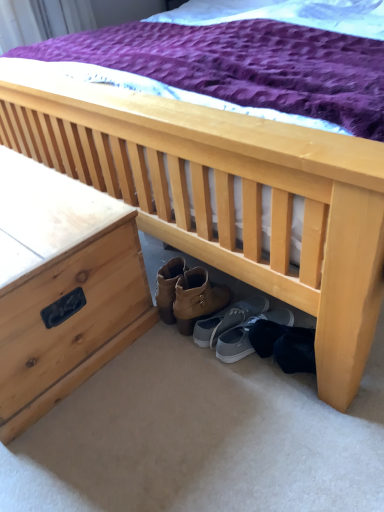
Question: Considering the relative positions of natural wood nightstand at left and gray suede shoes at center, the first footwear when ordered from left to right, in the image provided, is natural wood nightstand at left to the right of gray suede shoes at center, the first footwear when ordered from left to right, from the viewer's perspective?

Choices:
 (A) no
 (B) yes

Answer: (A)

Question: From the image's perspective, does natural wood nightstand at left appear higher than gray suede shoes at center, the first footwear when ordered from left to right?

Choices:
 (A) no
 (B) yes

Answer: (B)

Question: Does natural wood nightstand at left have a smaller size compared to gray suede shoes at center, the first footwear when ordered from left to right?

Choices:
 (A) yes
 (B) no

Answer: (B)

Question: Does natural wood nightstand at left have a greater height compared to gray suede shoes at center, the second footwear from the right?

Choices:
 (A) yes
 (B) no

Answer: (A)

Question: Does natural wood nightstand at left have a greater width compared to gray suede shoes at center, the first footwear when ordered from left to right?

Choices:
 (A) yes
 (B) no

Answer: (A)

Question: From the image's perspective, is natural wood nightstand at left above or below gray fabric shoe at lower center, which is the second footwear in left-to-right order?

Choices:
 (A) below
 (B) above

Answer: (B)

Question: Is natural wood nightstand at left situated inside gray fabric shoe at lower center, which is the second footwear in left-to-right order, or outside?

Choices:
 (A) outside
 (B) inside

Answer: (A)

Question: Does point (150, 314) appear closer or farther from the camera than point (236, 354)?

Choices:
 (A) closer
 (B) farther

Answer: (B)

Question: Looking at their shapes, would you say natural wood nightstand at left is wider or thinner than gray fabric shoe at lower center, which is the 1th footwear from right to left?

Choices:
 (A) wide
 (B) thin

Answer: (A)

Question: From a real-world perspective, is gray suede shoes at center, the second footwear from the right, above or below natural wood nightstand at left?

Choices:
 (A) above
 (B) below

Answer: (B)

Question: Based on their sizes in the image, would you say gray suede shoes at center, the first footwear when ordered from left to right, is bigger or smaller than natural wood nightstand at left?

Choices:
 (A) small
 (B) big

Answer: (A)

Question: Is gray suede shoes at center, the first footwear when ordered from left to right, wider or thinner than natural wood nightstand at left?

Choices:
 (A) thin
 (B) wide

Answer: (A)

Question: Is point (203, 324) positioned closer to the camera than point (11, 373)?

Choices:
 (A) farther
 (B) closer

Answer: (A)

Question: Considering the positions of gray fabric shoe at lower center, which is the second footwear in left-to-right order, and gray suede shoes at center, the first footwear when ordered from left to right, in the image, is gray fabric shoe at lower center, which is the second footwear in left-to-right order, taller or shorter than gray suede shoes at center, the first footwear when ordered from left to right,?

Choices:
 (A) short
 (B) tall

Answer: (A)

Question: From the image's perspective, is gray fabric shoe at lower center, which is the second footwear in left-to-right order, above or below gray suede shoes at center, the first footwear when ordered from left to right?

Choices:
 (A) below
 (B) above

Answer: (A)